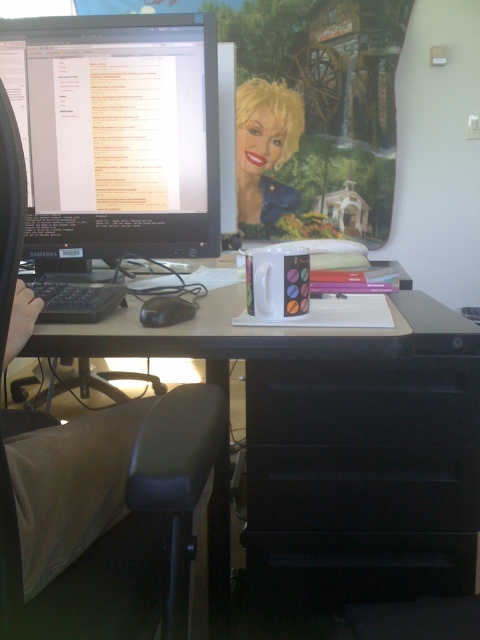
In the scene shown: You are standing in front of the desk and want to reach both the point at coordinates [440,337] and the point at coordinates [274,218]. Which point should you reach for first to minimize the distance traveled?

You should reach for the point at coordinates [440,337] first because it is closer to you than the point at coordinates [274,218], so you can grab it without moving further away.

You are a delivery person standing at the entrance of the office. You need to place a package that is 36 inches long on the floor. Is there enough space between you and the black matte file cabinet at lower right to lay the package flat without moving any furniture?

The black matte file cabinet at lower right is 34.13 inches away from the viewer. Since the package is 36 inches long, which is longer than the distance available, the package cannot be laid flat without moving the file cabinet.